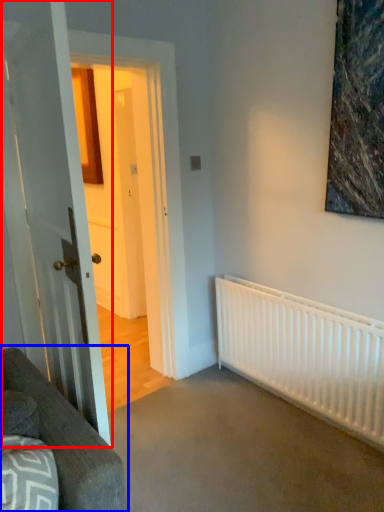
Question: Which of the following is the closest to the observer, door (highlighted by a red box) or studio couch (highlighted by a blue box)?

Choices:
 (A) door
 (B) studio couch

Answer: (B)